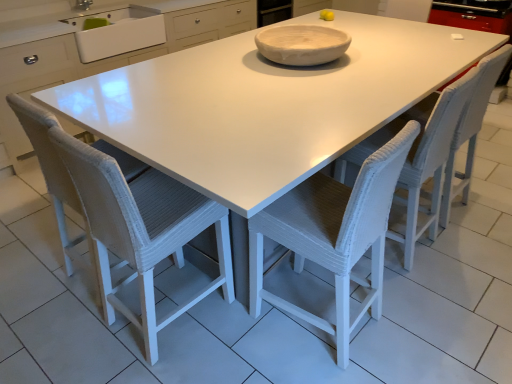
The height and width of the screenshot is (384, 512). What are the coordinates of `white woven chair at center, which is the first chair from left to right` in the screenshot? It's located at (129, 216).

What do you see at coordinates (117, 32) in the screenshot? This screenshot has height=384, width=512. I see `white ceramic sink at upper left` at bounding box center [117, 32].

Describe the element at coordinates (50, 169) in the screenshot. The image size is (512, 384). I see `white woven swivel chair at lower left` at that location.

You are a GUI agent. You are given a task and a screenshot of the screen. Output one action in this format:
    pyautogui.click(x=<x>, y=<y>)
    Task: Click on the white woven chair at center, which appears as the third chair when viewed from the right
    Image resolution: width=512 pixels, height=384 pixels.
    Given the screenshot: What is the action you would take?
    pyautogui.click(x=129, y=216)

Is white woven swivel chair at lower left not near white woven chair at center, arranged as the second chair when viewed from the left?

white woven swivel chair at lower left is near white woven chair at center, arranged as the second chair when viewed from the left, not far away.

Does point (78, 208) appear closer or farther from the camera than point (384, 209)?

Point (78, 208) appears to be farther away from the viewer than point (384, 209).

Does white woven swivel chair at lower left appear on the right side of white woven chair at center, which is the second chair in right-to-left order?

No.

Looking at the image, does white woven swivel chair at lower left seem bigger or smaller compared to white woven chair at center, arranged as the second chair when viewed from the left?

Considering their sizes, white woven swivel chair at lower left takes up more space than white woven chair at center, arranged as the second chair when viewed from the left.

Is white woven chair at center, which is the first chair from left to right, not near white woven swivel chair at lower left?

No.

Is white woven chair at center, which appears as the third chair when viewed from the right, aimed at white woven swivel chair at lower left?

No, white woven chair at center, which appears as the third chair when viewed from the right, does not turn towards white woven swivel chair at lower left.

Between white woven chair at center, which appears as the third chair when viewed from the right, and white woven swivel chair at lower left, which one has larger width?

Wider between the two is white woven chair at center, which appears as the third chair when viewed from the right.

Which object is positioned more to the left, white woven chair at center, which is the first chair from left to right, or white woven swivel chair at lower left?

From the viewer's perspective, white woven swivel chair at lower left appears more on the left side.

What's the angular difference between white woven chair at center, which appears as the third chair when viewed from the right, and white woven chair at center, the 1th chair when ordered from right to left,'s facing directions?

They differ by 90.2 degrees in their facing directions.

Identify the location of the 1st chair in front of the white woven chair at center, the 1th chair when ordered from right to left, counting from the anchor's position. (129, 216).

Can you see white woven chair at center, which is the first chair from left to right, touching white woven chair at center, which is the third chair in left-to-right order?

No, white woven chair at center, which is the first chair from left to right, is not in contact with white woven chair at center, which is the third chair in left-to-right order.

Can you confirm if white woven chair at center, which is the first chair from left to right, is shorter than white woven chair at center, the 1th chair when ordered from right to left?

In fact, white woven chair at center, which is the first chair from left to right, may be taller than white woven chair at center, the 1th chair when ordered from right to left.

Is white ceramic sink at upper left far from white woven swivel chair at lower left?

white ceramic sink at upper left is far away from white woven swivel chair at lower left.

From the image's perspective, is white ceramic sink at upper left above or below white woven swivel chair at lower left?

Clearly, from the image's perspective, white ceramic sink at upper left is above white woven swivel chair at lower left.

Who is smaller, white ceramic sink at upper left or white woven swivel chair at lower left?

With smaller size is white ceramic sink at upper left.

From the image's perspective, is white woven chair at center, which is the third chair in left-to-right order, located above or below white matte bowl at center?

white woven chair at center, which is the third chair in left-to-right order, is below white matte bowl at center.

How much distance is there between white woven chair at center, the 1th chair when ordered from right to left, and white matte bowl at center?

A distance of 28.93 inches exists between white woven chair at center, the 1th chair when ordered from right to left, and white matte bowl at center.

From a real-world perspective, is white woven chair at center, the 1th chair when ordered from right to left, above or below white matte bowl at center?

Clearly, from a real-world perspective, white woven chair at center, the 1th chair when ordered from right to left, is below white matte bowl at center.

Considering the relative sizes of white woven chair at center, which is the third chair in left-to-right order, and white matte bowl at center in the image provided, is white woven chair at center, which is the third chair in left-to-right order, bigger than white matte bowl at center?

Yes.

Based on the photo, is white woven swivel chair at lower left surrounded by white matte bowl at center?

Actually, white woven swivel chair at lower left is outside white matte bowl at center.

From the image's perspective, which object appears higher, white matte bowl at center or white woven swivel chair at lower left?

white matte bowl at center appears higher in the image.

Is white matte bowl at center at the right side of white woven swivel chair at lower left?

Yes, white matte bowl at center is to the right of white woven swivel chair at lower left.

Where is `swivel chair on the left of white matte bowl at center`? The width and height of the screenshot is (512, 384). swivel chair on the left of white matte bowl at center is located at coordinates (50, 169).

Considering the positions of objects white woven swivel chair at lower left and white woven chair at center, the 1th chair when ordered from right to left, in the image provided, who is more to the right, white woven swivel chair at lower left or white woven chair at center, the 1th chair when ordered from right to left,?

From the viewer's perspective, white woven chair at center, the 1th chair when ordered from right to left, appears more on the right side.

Is white woven swivel chair at lower left aimed at white woven chair at center, the 1th chair when ordered from right to left?

No, white woven swivel chair at lower left is not aimed at white woven chair at center, the 1th chair when ordered from right to left.

From the picture: From the image's perspective, which is below, white woven swivel chair at lower left or white woven chair at center, the 1th chair when ordered from right to left?

From the image's view, white woven swivel chair at lower left is below.

Locate an element on the screen. The image size is (512, 384). the 3rd chair located beneath the white woven swivel chair at lower left (from a real-world perspective) is located at coordinates (333, 234).

Locate an element on the screen. The height and width of the screenshot is (384, 512). swivel chair above the white woven chair at center, which is the first chair from left to right (from the image's perspective) is located at coordinates pyautogui.click(x=50, y=169).

From the image, which object appears to be nearer to white woven chair at center, which is the first chair from left to right, white ceramic sink at upper left or white matte bowl at center?

white matte bowl at center is closer to white woven chair at center, which is the first chair from left to right.

From the image, which object appears to be nearer to white woven swivel chair at lower left, white matte bowl at center or white woven chair at center, which appears as the third chair when viewed from the right?

white woven chair at center, which appears as the third chair when viewed from the right, is closer to white woven swivel chair at lower left.

Based on their spatial positions, is white woven swivel chair at lower left or white woven chair at center, which is the first chair from left to right, closer to white woven chair at center, arranged as the second chair when viewed from the left?

white woven chair at center, which is the first chair from left to right, lies closer to white woven chair at center, arranged as the second chair when viewed from the left, than the other object.

Which object lies nearer to the anchor point white ceramic sink at upper left, white matte bowl at center or white woven chair at center, which is the second chair in right-to-left order?

Based on the image, white matte bowl at center appears to be nearer to white ceramic sink at upper left.

Considering their positions, is white woven chair at center, arranged as the second chair when viewed from the left, positioned closer to white woven chair at center, which is the third chair in left-to-right order, than white ceramic sink at upper left?

white woven chair at center, arranged as the second chair when viewed from the left.

Looking at the image, which one is located further to white woven chair at center, which is the second chair in right-to-left order, white ceramic sink at upper left or white matte bowl at center?

white ceramic sink at upper left is further to white woven chair at center, which is the second chair in right-to-left order.

Considering their positions, is white woven chair at center, which is the third chair in left-to-right order, positioned further to white woven swivel chair at lower left than white woven chair at center, arranged as the second chair when viewed from the left?

Among the two, white woven chair at center, which is the third chair in left-to-right order, is located further to white woven swivel chair at lower left.

Considering their positions, is white woven chair at center, the 1th chair when ordered from right to left, positioned further to white ceramic sink at upper left than white woven swivel chair at lower left?

white woven chair at center, the 1th chair when ordered from right to left.

You are a GUI agent. You are given a task and a screenshot of the screen. Output one action in this format:
    pyautogui.click(x=<x>, y=<y>)
    Task: Click on the chair between white woven chair at center, which is the first chair from left to right, and white woven chair at center, which is the third chair in left-to-right order, in the horizontal direction
    This screenshot has height=384, width=512.
    Given the screenshot: What is the action you would take?
    pyautogui.click(x=333, y=234)

In order to click on bowl between white woven swivel chair at lower left and white woven chair at center, which is the third chair in left-to-right order in this screenshot , I will do `click(302, 44)`.

Find the location of a particular element. The height and width of the screenshot is (384, 512). bowl between white woven chair at center, which is the first chair from left to right, and white woven chair at center, the 1th chair when ordered from right to left is located at coordinates (302, 44).

Locate an element on the screen. swivel chair between white ceramic sink at upper left and white woven chair at center, the 1th chair when ordered from right to left is located at coordinates (50, 169).